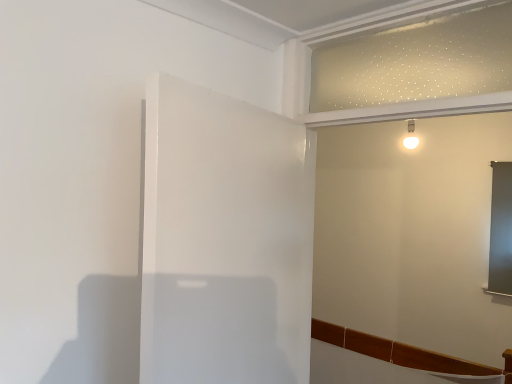
Question: In terms of width, does white glossy door at center look wider or thinner when compared to matte white wall at upper center?

Choices:
 (A) thin
 (B) wide

Answer: (A)

Question: In terms of size, does white glossy door at center appear bigger or smaller than matte white wall at upper center?

Choices:
 (A) big
 (B) small

Answer: (B)

Question: Is point (193, 218) closer or farther from the camera than point (485, 119)?

Choices:
 (A) farther
 (B) closer

Answer: (B)

Question: Considering the positions of point (337, 221) and point (150, 82), is point (337, 221) closer or farther from the camera than point (150, 82)?

Choices:
 (A) farther
 (B) closer

Answer: (A)

Question: Looking at the image, does matte white wall at upper center seem bigger or smaller compared to white glossy door at center?

Choices:
 (A) small
 (B) big

Answer: (B)

Question: Is matte white wall at upper center in front of or behind white glossy door at center in the image?

Choices:
 (A) front
 (B) behind

Answer: (B)

Question: Is matte white wall at upper center to the left or to the right of white glossy door at center in the image?

Choices:
 (A) left
 (B) right

Answer: (B)